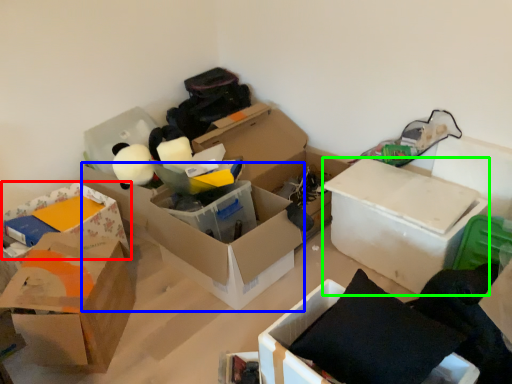
Question: Based on their relative distances, which object is nearer to box (highlighted by a red box)? Choose from box (highlighted by a blue box) and box (highlighted by a green box).

Choices:
 (A) box
 (B) box

Answer: (A)